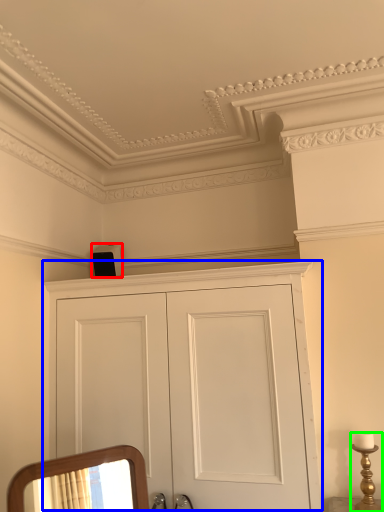
Question: Considering the real-world distances, which object is farthest from speaker (highlighted by a red box)? cupboard (highlighted by a blue box) or candle holder (highlighted by a green box)?

Choices:
 (A) cupboard
 (B) candle holder

Answer: (B)